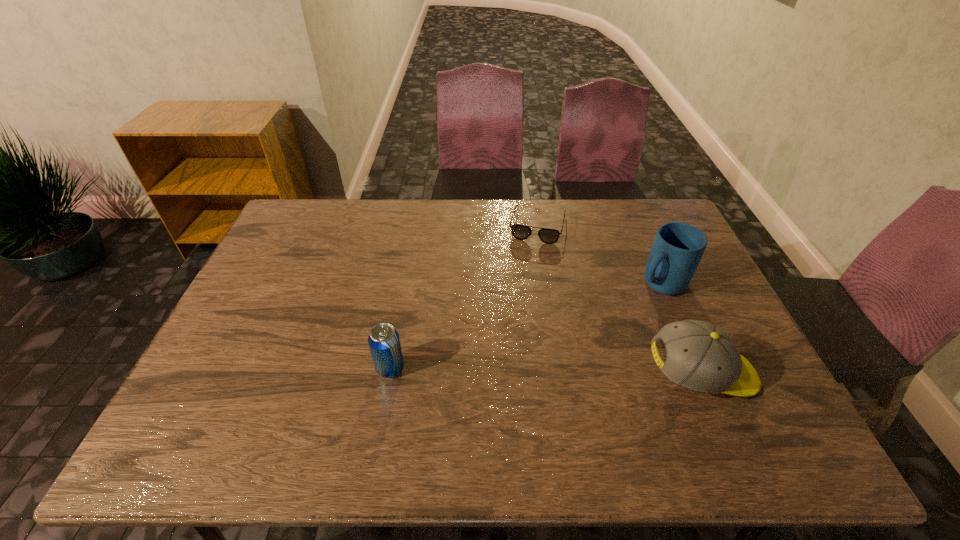
Locate an element on the screen. Image resolution: width=960 pixels, height=540 pixels. vacant space on the desktop that is between the beer can and the baseball cap and is positioned on the side of the third nearest object with the handle is located at coordinates (539, 371).

You are a GUI agent. You are given a task and a screenshot of the screen. Output one action in this format:
    pyautogui.click(x=<x>, y=<y>)
    Task: Click on the vacant spot on the desktop that is between the leftmost object and the baseball cap and is positioned on the front-facing side of the shortest object
    
    Given the screenshot: What is the action you would take?
    pyautogui.click(x=504, y=370)